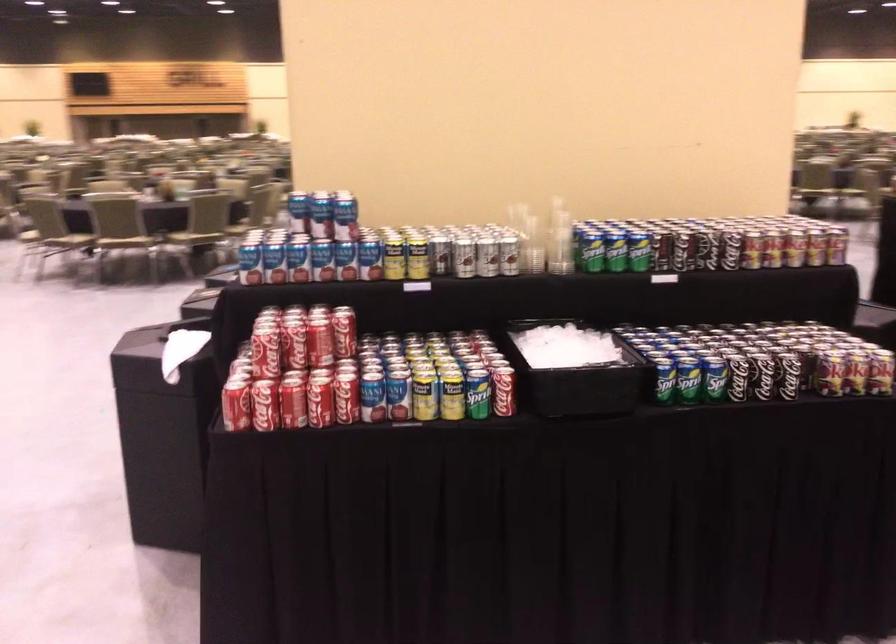
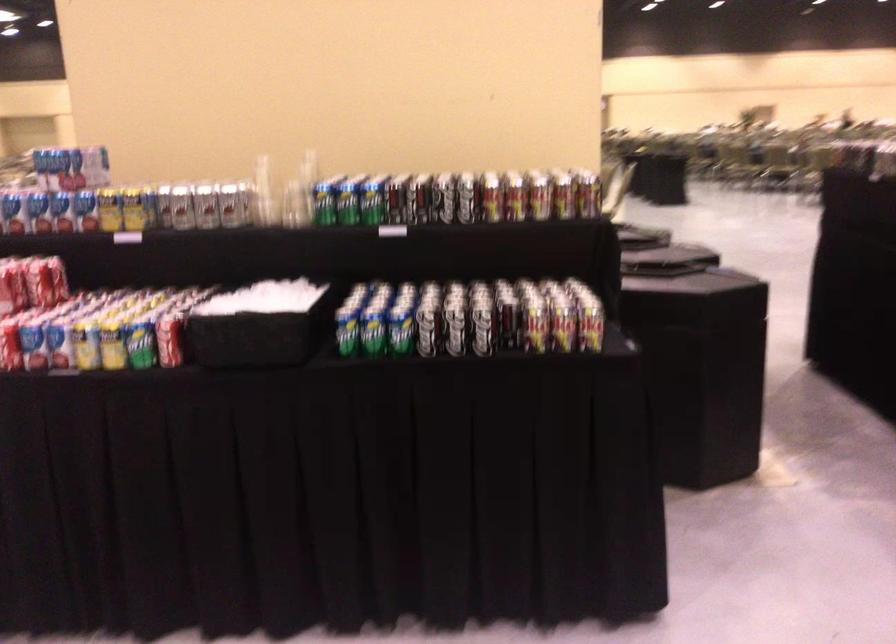
In the second image, find the point that corresponds to the point at 342,336 in the first image.

(40, 283)